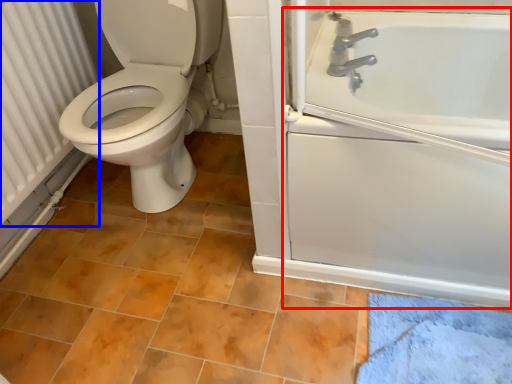
Question: Which object appears closest to the camera in this image, bath (highlighted by a red box) or radiator (highlighted by a blue box)?

Choices:
 (A) bath
 (B) radiator

Answer: (A)